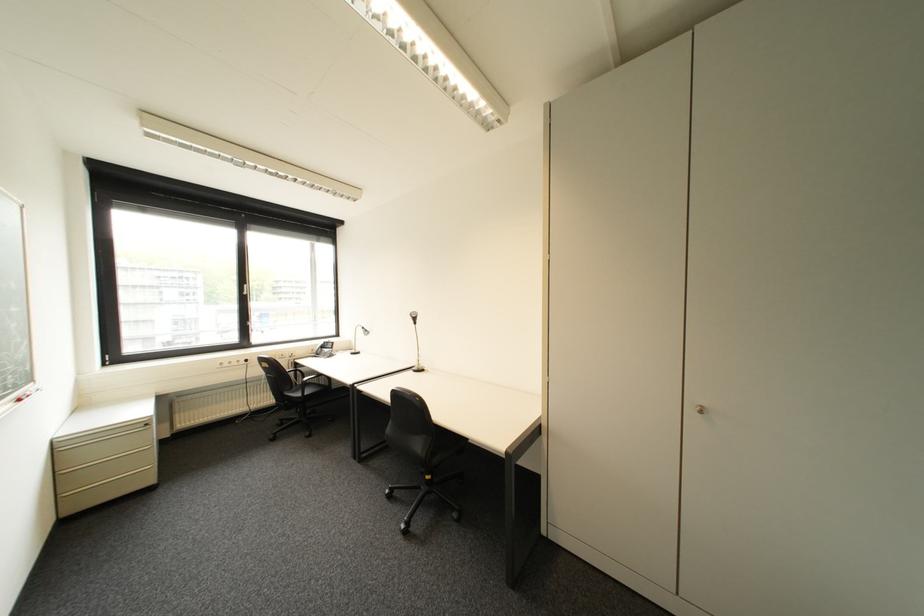
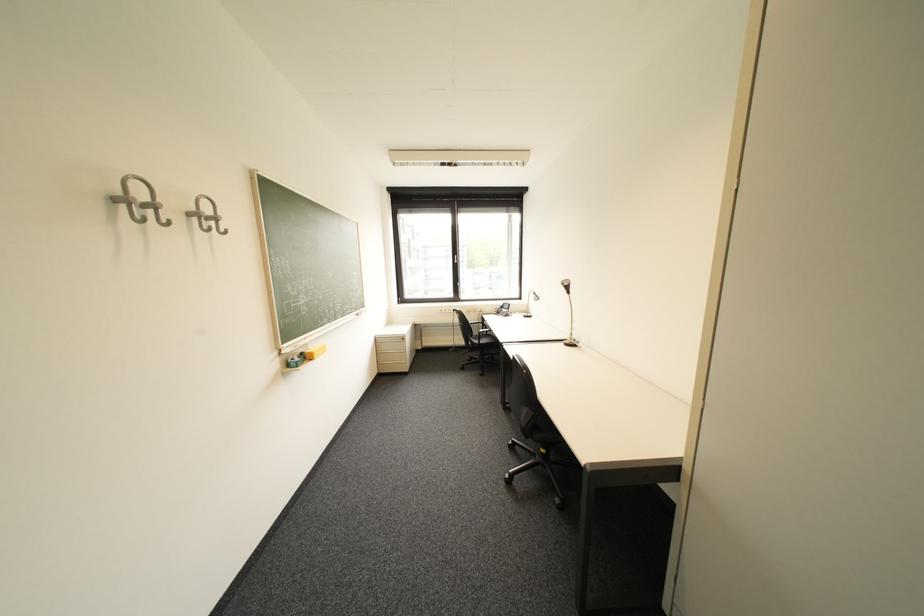
Where in the second image is the point corresponding to pixel 315 379 from the first image?

(492, 331)